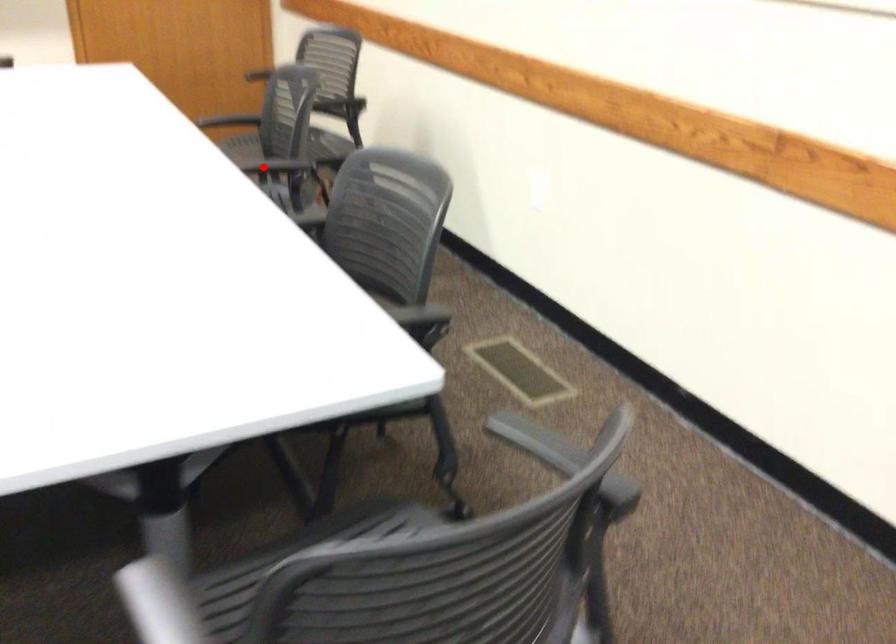
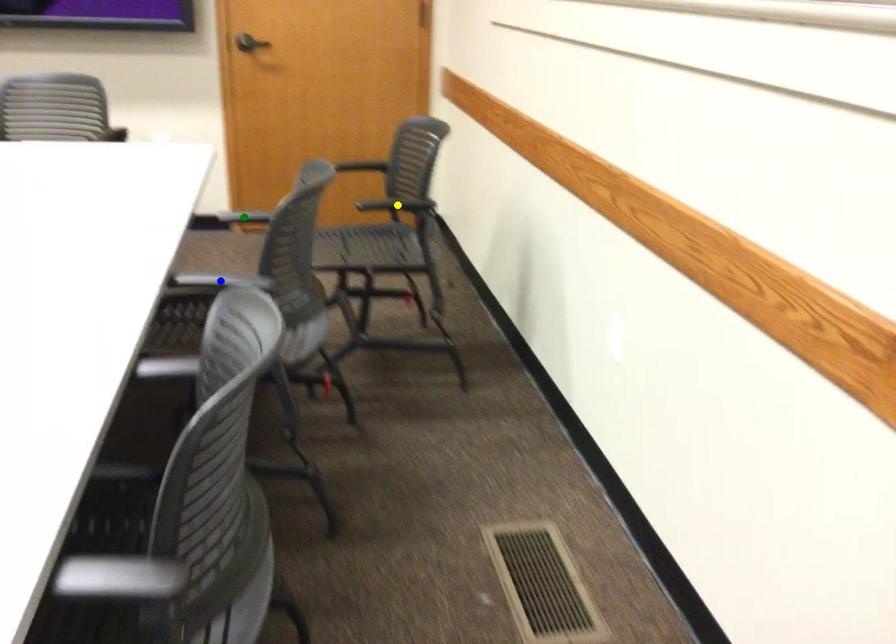
Question: I am providing you with two images of the same scene from different viewpoints. A red point is marked on the first image. You are given multiple points on the second image. Which mark in image 2 goes with the point in image 1?

Choices:
 (A) green point
 (B) blue point
 (C) yellow point

Answer: (B)